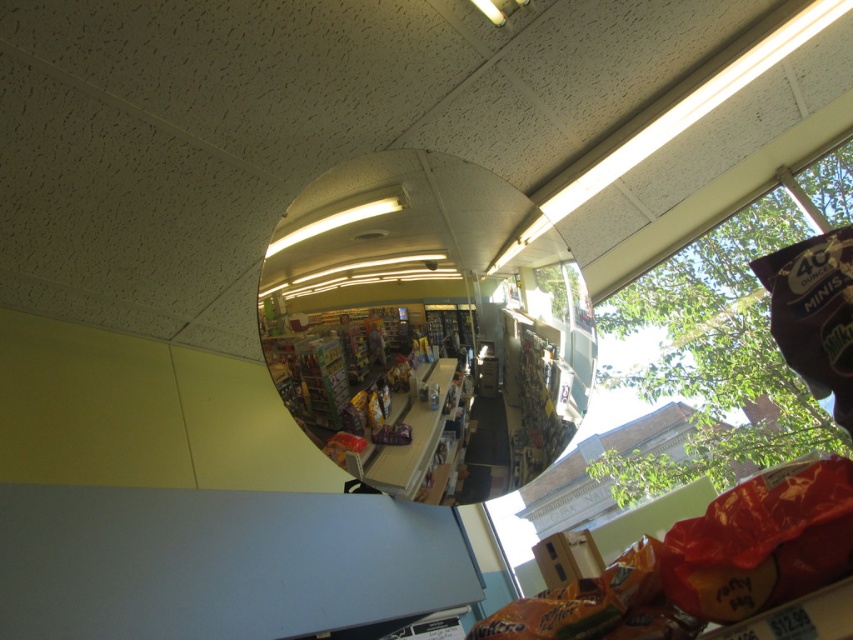
In the scene shown: You are a customer in the convenience store and want to grab the matte brown bag of chips at center. However, you notice the clear glass mirror at center is in your way. Can you reach the chips without moving the mirror?

The clear glass mirror at center is located above the matte brown bag of chips at center, so you can reach the chips without moving the mirror because the mirror is above it, not blocking the front.

You are standing in the convenience store looking up at the ceiling mirror. There is a point marked at coordinates (421,326). What object is located at this point?

The point at coordinates (421,326) marks the clear glass mirror at center.

You are standing in a convenience store and looking up at the clear glass mirror at center. If the mirror is 3.78 feet away from you, can you comfortably read the small text on a product label reflected in the mirror without moving closer?

The clear glass mirror at center is 3.78 feet from the camera. Since the mirror is at this distance, reading small text on a product label reflected in it might be challenging without moving closer for a better view.